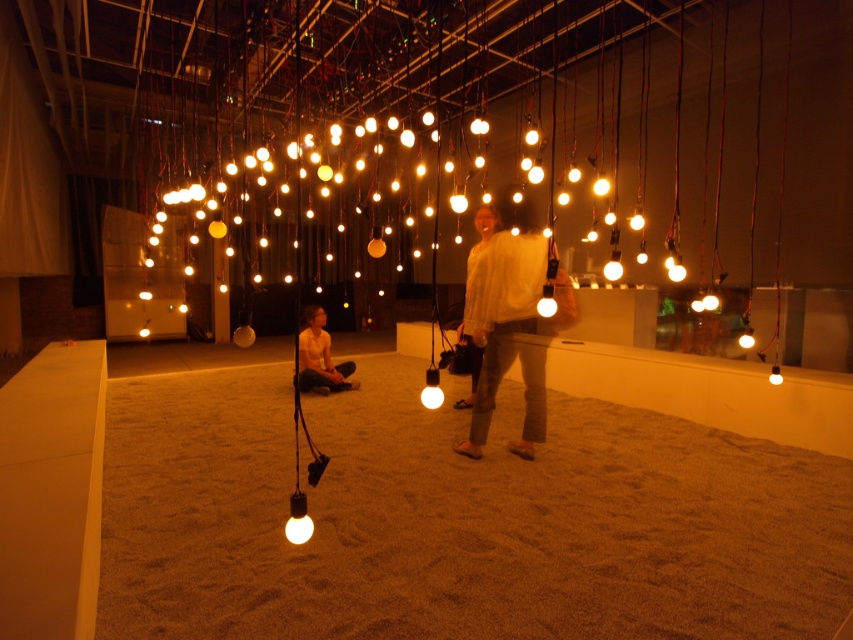
Question: Where is white fluffy sweater at center located in relation to white matte light bulb at center in the image?

Choices:
 (A) below
 (B) above

Answer: (B)

Question: Which point appears closest to the camera in this image?

Choices:
 (A) [x=339, y=362]
 (B) [x=477, y=308]

Answer: (B)

Question: Can you confirm if white fluffy sweater at center is thinner than white matte light bulb at center?

Choices:
 (A) yes
 (B) no

Answer: (B)

Question: Which object is the closest to the white matte light bulb at center?

Choices:
 (A) brown textured sand at center
 (B) white fuzzy sweater at center
 (C) white fluffy sweater at center

Answer: (A)

Question: Which point is farther to the camera?

Choices:
 (A) white fuzzy sweater at center
 (B) white fluffy sweater at center

Answer: (A)

Question: Does white fluffy sweater at center come behind white fuzzy sweater at center?

Choices:
 (A) no
 (B) yes

Answer: (A)